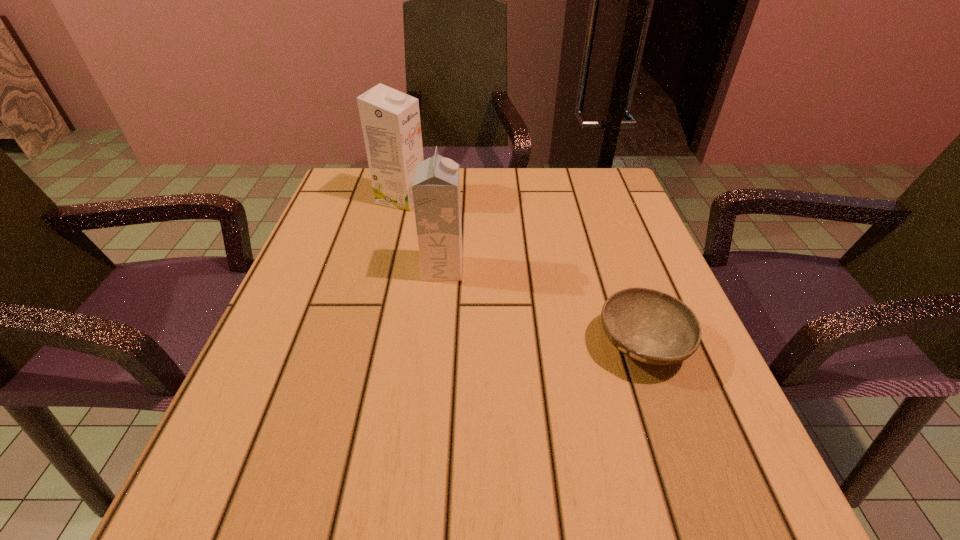
You are a GUI agent. You are given a task and a screenshot of the screen. Output one action in this format:
    pyautogui.click(x=<x>, y=<y>)
    Task: Click on the free space between the nearest object and the nearer carton
    The image size is (960, 540).
    Given the screenshot: What is the action you would take?
    pyautogui.click(x=543, y=306)

What are the coordinates of `empty location between the bowl and the second object from right to left` in the screenshot? It's located at (543, 306).

Where is `vacant point located between the nearest object and the left carton`? The image size is (960, 540). vacant point located between the nearest object and the left carton is located at coordinates (522, 271).

Identify the location of vacant space that's between the bowl and the second nearest object. (543, 306).

At what (x,y) coordinates should I click in order to perform the action: click on vacant area that lies between the nearest object and the farther carton. Please return your answer as a coordinate pair (x, y). The height and width of the screenshot is (540, 960). Looking at the image, I should click on (522, 271).

Find the location of `empty location between the second nearest object and the bowl`. empty location between the second nearest object and the bowl is located at coordinates (543, 306).

The image size is (960, 540). I want to click on vacant space that is in between the bowl and the right carton, so click(543, 306).

Where is `object that is the second closest to the rightmost object`? object that is the second closest to the rightmost object is located at coordinates (390, 119).

Identify the location of object that is the second closest one to the right carton. (649, 326).

Where is `blank area in the image that satisfies the following two spatial constraints: 1. on the front label of the right carton; 2. on the back side of the rightmost object`? This screenshot has width=960, height=540. blank area in the image that satisfies the following two spatial constraints: 1. on the front label of the right carton; 2. on the back side of the rightmost object is located at coordinates (436, 344).